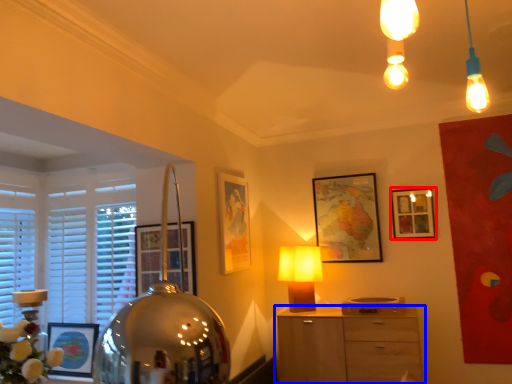
Question: Which object is further to the camera taking this photo, picture frame (highlighted by a red box) or chest of drawers (highlighted by a blue box)?

Choices:
 (A) picture frame
 (B) chest of drawers

Answer: (A)